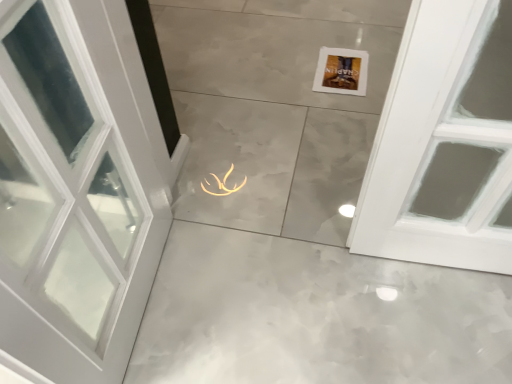
Image resolution: width=512 pixels, height=384 pixels. In order to click on unoccupied region to the right of matte gold postcard at upper right in this screenshot , I will do `click(380, 64)`.